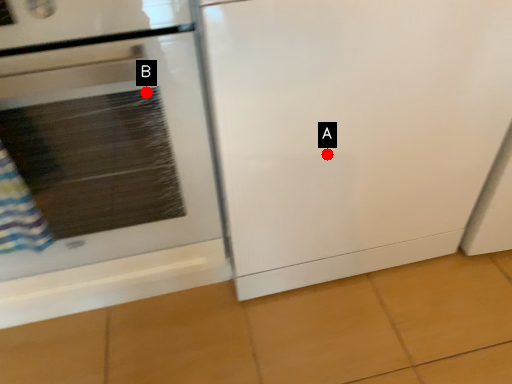
Question: Two points are circled on the image, labeled by A and B beside each circle. Which of the following is the farthest from the observer?

Choices:
 (A) A is further
 (B) B is further

Answer: (A)